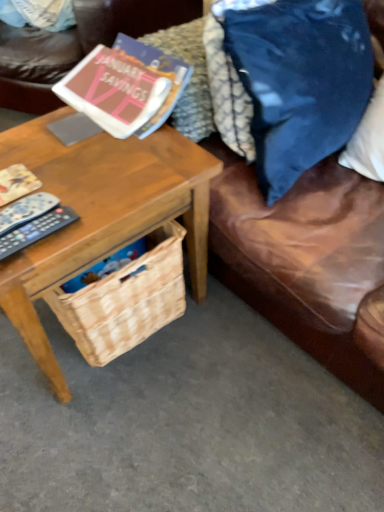
Question: From a real-world perspective, is matte paper book at upper left positioned over black plastic remote control at left, which is counted as the first remote control, starting from the bottom, based on gravity?

Choices:
 (A) yes
 (B) no

Answer: (A)

Question: Is matte paper book at upper left oriented towards black plastic remote control at left, the second remote control positioned from the top?

Choices:
 (A) yes
 (B) no

Answer: (A)

Question: Considering the relative sizes of matte paper book at upper left and black plastic remote control at left, the second remote control positioned from the top, in the image provided, is matte paper book at upper left taller than black plastic remote control at left, the second remote control positioned from the top,?

Choices:
 (A) no
 (B) yes

Answer: (B)

Question: Is matte paper book at upper left further to the viewer compared to black plastic remote control at left, the second remote control positioned from the top?

Choices:
 (A) yes
 (B) no

Answer: (A)

Question: Is matte paper book at upper left completely or partially outside of black plastic remote control at left, which is counted as the first remote control, starting from the bottom?

Choices:
 (A) yes
 (B) no

Answer: (A)

Question: Relative to brown leather couch at lower right, is matte paper book at upper left in front or behind?

Choices:
 (A) front
 (B) behind

Answer: (B)

Question: Looking at the image, does matte paper book at upper left seem bigger or smaller compared to brown leather couch at lower right?

Choices:
 (A) big
 (B) small

Answer: (B)

Question: From a real-world perspective, is matte paper book at upper left positioned above or below brown leather couch at lower right?

Choices:
 (A) above
 (B) below

Answer: (A)

Question: Would you say matte paper book at upper left is to the left or to the right of brown leather couch at lower right in the picture?

Choices:
 (A) left
 (B) right

Answer: (A)

Question: Relative to black plastic remote at left, which is the 1th remote control from top to bottom, is blue velvet pillow at upper right in front or behind?

Choices:
 (A) behind
 (B) front

Answer: (B)

Question: Considering the positions of point (294, 51) and point (39, 200), is point (294, 51) closer or farther from the camera than point (39, 200)?

Choices:
 (A) farther
 (B) closer

Answer: (A)

Question: Is blue velvet pillow at upper right wider or thinner than black plastic remote at left, which is the 1th remote control from top to bottom?

Choices:
 (A) wide
 (B) thin

Answer: (A)

Question: Is blue velvet pillow at upper right to the left or to the right of black plastic remote at left, which is the 1th remote control from top to bottom, in the image?

Choices:
 (A) left
 (B) right

Answer: (B)

Question: Does point (256, 237) appear closer or farther from the camera than point (117, 36)?

Choices:
 (A) closer
 (B) farther

Answer: (A)

Question: From a real-world perspective, relative to matte paper book at upper left, is brown leather couch at lower right vertically above or below?

Choices:
 (A) below
 (B) above

Answer: (A)